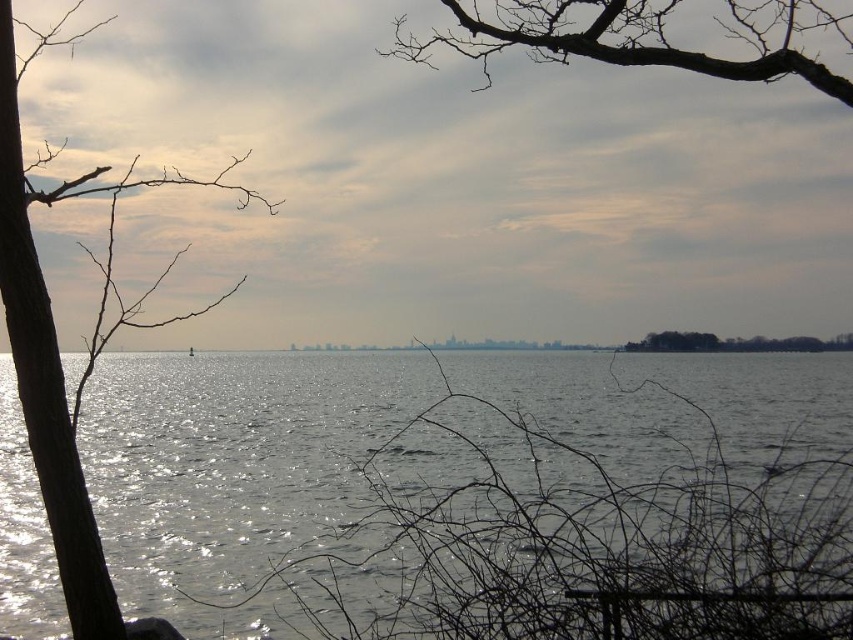
You are standing at the lakeside and want to determine which of the two points, point (97, 625) or point (648, 332), is closer to you. Based on the scene description, which point is nearer?

Point (97, 625) is closer to the viewer than point (648, 332).